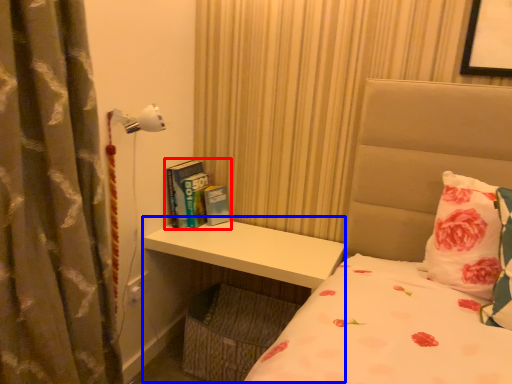
Question: Which object is further to the camera taking this photo, book (highlighted by a red box) or table (highlighted by a blue box)?

Choices:
 (A) book
 (B) table

Answer: (A)